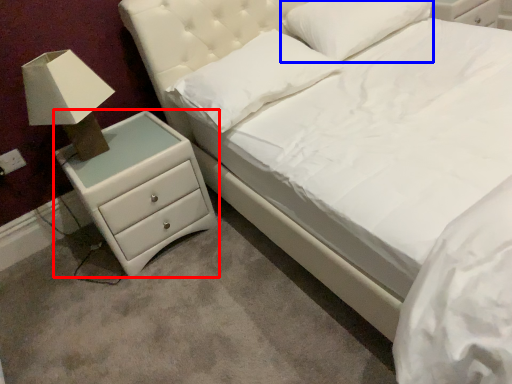
Question: Among these objects, which one is farthest to the camera, chest of drawers (highlighted by a red box) or pillow (highlighted by a blue box)?

Choices:
 (A) chest of drawers
 (B) pillow

Answer: (B)